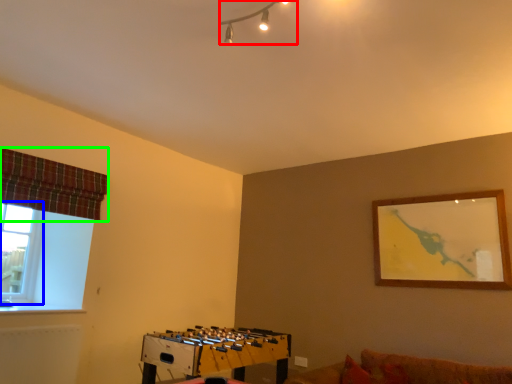
Question: Based on their relative distances, which object is farther from lamp (highlighted by a red box)? Choose from window (highlighted by a blue box) and curtain (highlighted by a green box).

Choices:
 (A) window
 (B) curtain

Answer: (A)